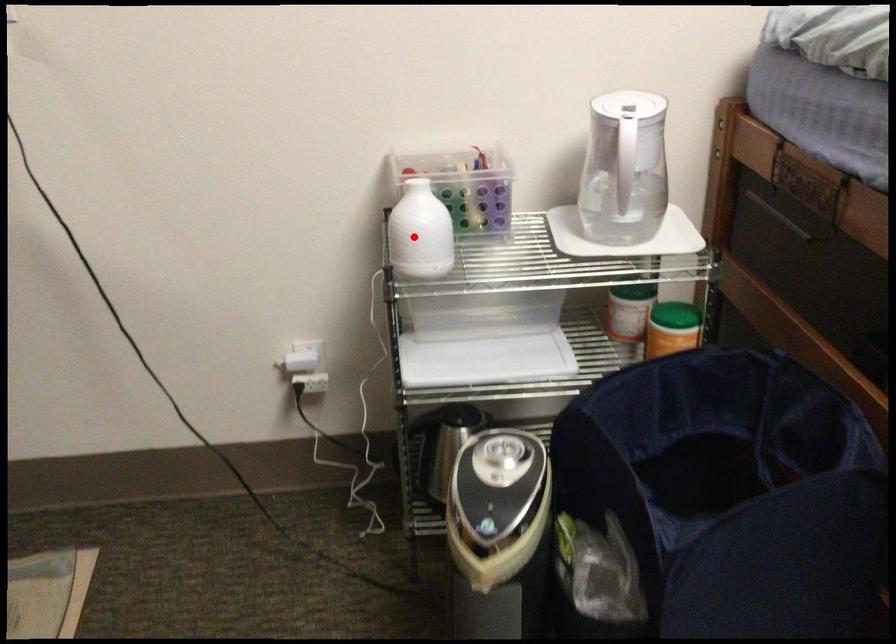
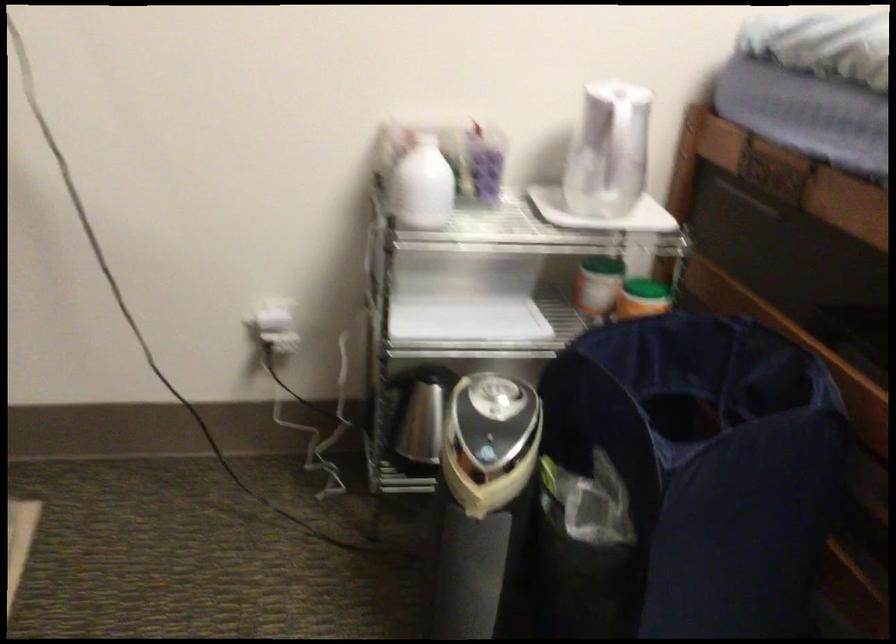
The point at the highlighted location is marked in the first image. Where is the corresponding point in the second image?

(421, 185)